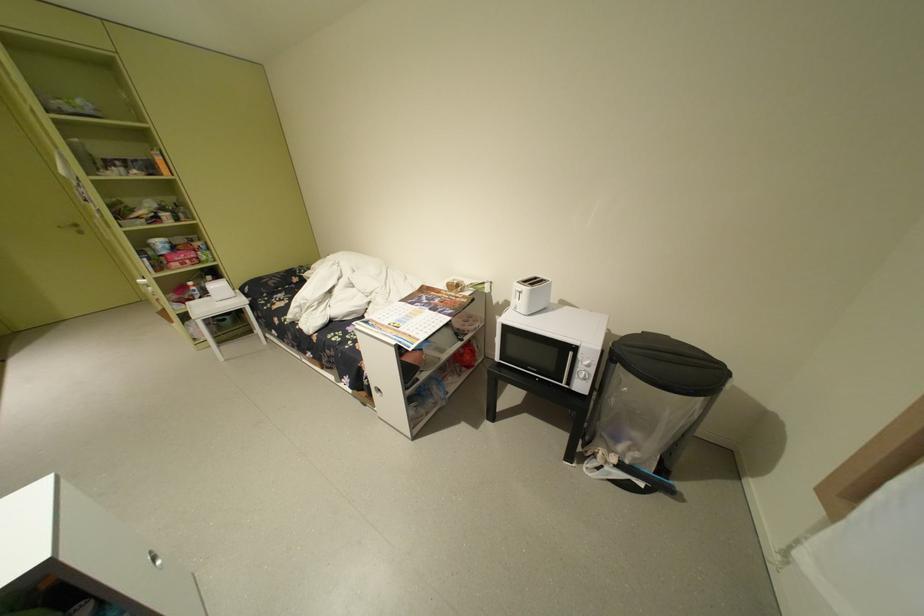
The width and height of the screenshot is (924, 616). I want to click on black trash can lid, so 670,363.